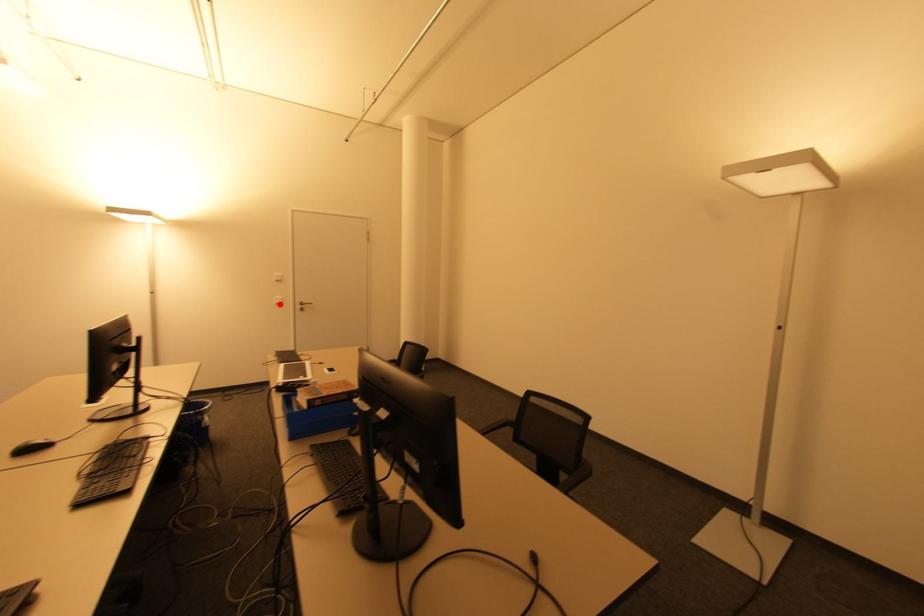
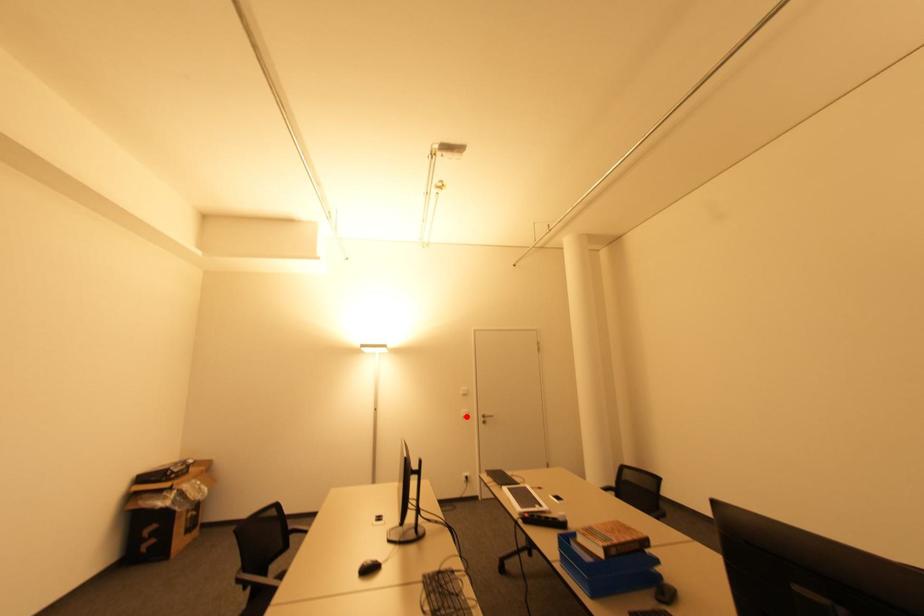
I am providing you with two images of the same scene from different viewpoints. A red point is marked on the first image and another point is marked on the second image. Does the point marked in image1 correspond to the same location as the one in image2?

Yes